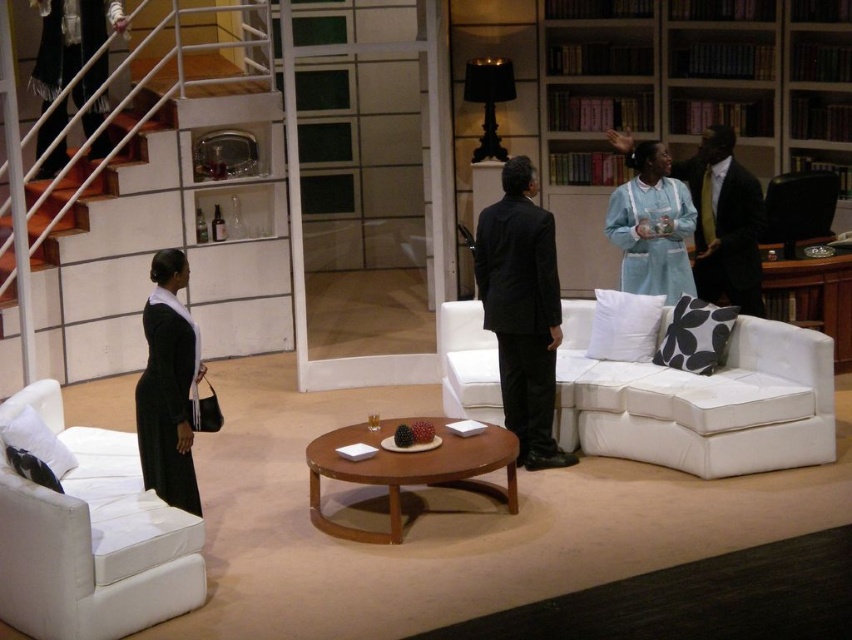
Can you confirm if light blue fabric bookshelf at upper right is shorter than matte black dress at left?

In fact, light blue fabric bookshelf at upper right may be taller than matte black dress at left.

Identify the location of light blue fabric bookshelf at upper right. (684, 97).

What do you see at coordinates (409, 470) in the screenshot? This screenshot has width=852, height=640. I see `brown wooden coffee table at center` at bounding box center [409, 470].

Does brown wooden coffee table at center have a smaller size compared to matte black dress at left?

No, brown wooden coffee table at center is not smaller than matte black dress at left.

Which is behind, point (504, 493) or point (150, 385)?

Point (504, 493)

Locate an element on the screen. brown wooden coffee table at center is located at coordinates (409, 470).

Between light blue fabric bookshelf at upper right and black leather armchair at right, which one is positioned lower?

Positioned lower is black leather armchair at right.

Between light blue fabric bookshelf at upper right and black leather armchair at right, which one appears on the left side from the viewer's perspective?

Positioned to the left is light blue fabric bookshelf at upper right.

The height and width of the screenshot is (640, 852). Find the location of `light blue fabric bookshelf at upper right`. light blue fabric bookshelf at upper right is located at coordinates (684, 97).